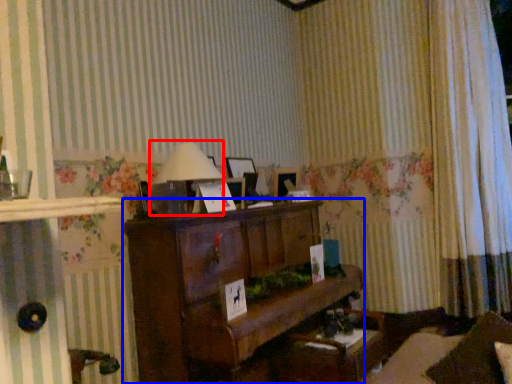
Question: Which point is further to the camera, table lamp (highlighted by a red box) or furniture (highlighted by a blue box)?

Choices:
 (A) table lamp
 (B) furniture

Answer: (A)